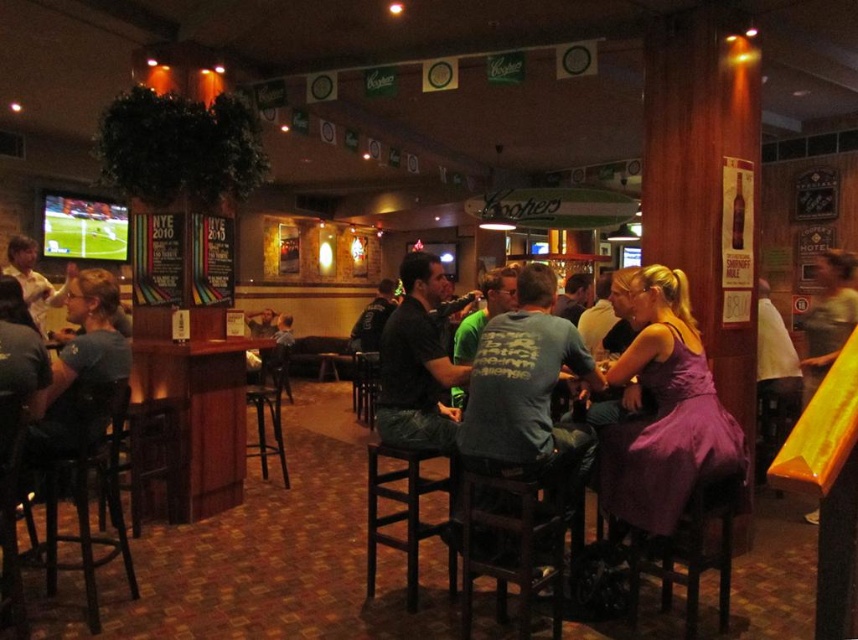
Question: Does matte blue shirt at left appear under black wooden bar stool at center?

Choices:
 (A) yes
 (B) no

Answer: (B)

Question: Which object appears farthest from the camera in this image?

Choices:
 (A) gray cotton t-shirt at center
 (B) matte blue shirt at left
 (C) dark gray shirt at center

Answer: (C)

Question: Which of the following is the farthest from the observer?

Choices:
 (A) (427, 381)
 (B) (515, 385)
 (C) (38, 452)

Answer: (A)

Question: Among these objects, which one is nearest to the camera?

Choices:
 (A) matte blue shirt at left
 (B) yellow fabric at right
 (C) gray cotton t-shirt at center

Answer: (C)

Question: Is dark gray shirt at center further to camera compared to black wooden bar stool at center?

Choices:
 (A) yes
 (B) no

Answer: (B)

Question: Is purple satin dress at center wider than black wooden bar stool at center?

Choices:
 (A) yes
 (B) no

Answer: (B)